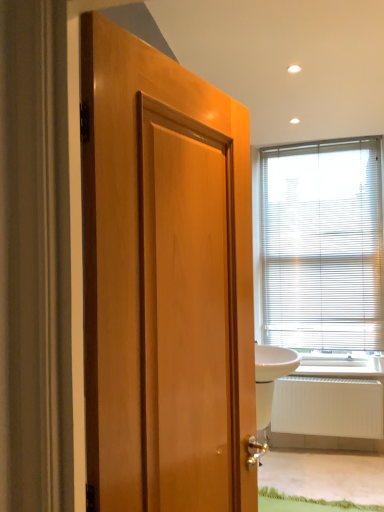
In order to face white matte radiator at lower right, should I rotate leftwards or rightwards?

You should rotate right by 17.160 degrees.

The image size is (384, 512). Identify the location of wooden door at center. (165, 282).

In order to face white plastic blinds at upper right, should I rotate leftwards or rightwards?

Turn right by 17.038 degrees to look at white plastic blinds at upper right.

What do you see at coordinates (322, 246) in the screenshot?
I see `white plastic blinds at upper right` at bounding box center [322, 246].

What do you see at coordinates (270, 377) in the screenshot? I see `white glossy sink at right` at bounding box center [270, 377].

This screenshot has height=512, width=384. I want to click on white matte radiator at lower right, so click(328, 407).

Which of these two, white plastic blinds at upper right or white glossy sink at right, is bigger?

white glossy sink at right.

From the image's perspective, which is below, white plastic blinds at upper right or white glossy sink at right?

white glossy sink at right appears lower in the image.

Considering the relative sizes of white plastic blinds at upper right and white glossy sink at right in the image provided, is white plastic blinds at upper right shorter than white glossy sink at right?

No, white plastic blinds at upper right is not shorter than white glossy sink at right.

Considering the relative sizes of white plastic blinds at upper right and white glossy sink at right in the image provided, is white plastic blinds at upper right thinner than white glossy sink at right?

Yes, white plastic blinds at upper right is thinner than white glossy sink at right.

Is the position of white plastic blinds at upper right more distant than that of wooden door at center?

Yes, white plastic blinds at upper right is behind wooden door at center.

In terms of size, does white plastic blinds at upper right appear bigger or smaller than wooden door at center?

Considering their sizes, white plastic blinds at upper right takes up more space than wooden door at center.

How different are the orientations of white plastic blinds at upper right and wooden door at center in degrees?

The facing directions of white plastic blinds at upper right and wooden door at center are 178 degrees apart.

Is white plastic blinds at upper right to the left of wooden door at center from the viewer's perspective?

No.

At what (x,y) coordinates should I click in order to perform the action: click on radiator behind the white glossy sink at right. Please return your answer as a coordinate pair (x, y). Looking at the image, I should click on (328, 407).

Which is in front, white matte radiator at lower right or white glossy sink at right?

white glossy sink at right is closer to the camera.

Which object is positioned more to the right, white matte radiator at lower right or white glossy sink at right?

white matte radiator at lower right.

Looking at their sizes, would you say white matte radiator at lower right is wider or thinner than white glossy sink at right?

Considering their sizes, white matte radiator at lower right looks slimmer than white glossy sink at right.

In the scene shown: Are white matte radiator at lower right and wooden door at center beside each other?

No, white matte radiator at lower right is not next to wooden door at center.

Is white matte radiator at lower right in front of wooden door at center?

No, white matte radiator at lower right is further to the viewer.

From a real-world perspective, between white matte radiator at lower right and wooden door at center, who is vertically lower?

white matte radiator at lower right, from a real-world perspective.

Is white matte radiator at lower right looking in the opposite direction of wooden door at center?

No, wooden door at center is not at the back of white matte radiator at lower right.

Are white glossy sink at right and wooden door at center located far from each other?

Yes.

Which is closer to the camera, (266, 417) or (100, 285)?

The point (100, 285) is closer to the camera.

Visually, is white glossy sink at right positioned to the left or to the right of wooden door at center?

Based on their positions, white glossy sink at right is located to the right of wooden door at center.

Find the location of a particular element. Image resolution: width=384 pixels, height=512 pixels. door in front of the white plastic blinds at upper right is located at coordinates (165, 282).

Can you confirm if wooden door at center is shorter than white plastic blinds at upper right?

Correct, wooden door at center is not as tall as white plastic blinds at upper right.

From the image's perspective, is wooden door at center located beneath white plastic blinds at upper right?

Yes, from the image's perspective, wooden door at center is beneath white plastic blinds at upper right.

Could you tell me if white plastic blinds at upper right is turned towards white matte radiator at lower right?

No, white plastic blinds at upper right is not aimed at white matte radiator at lower right.

Between white plastic blinds at upper right and white matte radiator at lower right, which one is positioned behind?

white plastic blinds at upper right is behind.

Based on the photo, is white plastic blinds at upper right far from white matte radiator at lower right?

No, white plastic blinds at upper right is not far away from white matte radiator at lower right.

What are the coordinates of `window blind that appears on the right of white matte radiator at lower right` in the screenshot? It's located at (322, 246).

The height and width of the screenshot is (512, 384). What are the coordinates of `window blind on the right of white glossy sink at right` in the screenshot? It's located at (322, 246).

You are a GUI agent. You are given a task and a screenshot of the screen. Output one action in this format:
    pyautogui.click(x=<x>, y=<y>)
    Task: Click on the window blind above the wooden door at center (from a real-world perspective)
    The width and height of the screenshot is (384, 512).
    Given the screenshot: What is the action you would take?
    pyautogui.click(x=322, y=246)

Based on their spatial positions, is white plastic blinds at upper right or white matte radiator at lower right further from wooden door at center?

Among the two, white plastic blinds at upper right is located further to wooden door at center.

Looking at the image, which one is located closer to white matte radiator at lower right, white plastic blinds at upper right or white glossy sink at right?

Among the two, white glossy sink at right is located nearer to white matte radiator at lower right.

Estimate the real-world distances between objects in this image. Which object is further from wooden door at center, white glossy sink at right or white plastic blinds at upper right?

white plastic blinds at upper right is positioned further to the anchor wooden door at center.

Based on their spatial positions, is wooden door at center or white glossy sink at right further from white plastic blinds at upper right?

wooden door at center lies further to white plastic blinds at upper right than the other object.

Based on their spatial positions, is white plastic blinds at upper right or wooden door at center closer to white matte radiator at lower right?

Among the two, white plastic blinds at upper right is located nearer to white matte radiator at lower right.

Which object lies nearer to the anchor point white plastic blinds at upper right, white matte radiator at lower right or white glossy sink at right?

Among the two, white matte radiator at lower right is located nearer to white plastic blinds at upper right.

From the image, which object appears to be nearer to white plastic blinds at upper right, white glossy sink at right or wooden door at center?

white glossy sink at right is positioned closer to the anchor white plastic blinds at upper right.

In the scene shown: Considering their positions, is white plastic blinds at upper right positioned closer to wooden door at center than white glossy sink at right?

white glossy sink at right is positioned closer to the anchor wooden door at center.

The width and height of the screenshot is (384, 512). I want to click on radiator between wooden door at center and white plastic blinds at upper right along the z-axis, so click(x=328, y=407).

Find the location of a particular element. sink located between wooden door at center and white plastic blinds at upper right in the depth direction is located at coordinates (270, 377).

Locate an element on the screen. The height and width of the screenshot is (512, 384). sink located between wooden door at center and white matte radiator at lower right in the depth direction is located at coordinates (270, 377).

At what (x,y) coordinates should I click in order to perform the action: click on sink between white plastic blinds at upper right and white matte radiator at lower right from top to bottom. Please return your answer as a coordinate pair (x, y). Looking at the image, I should click on (270, 377).